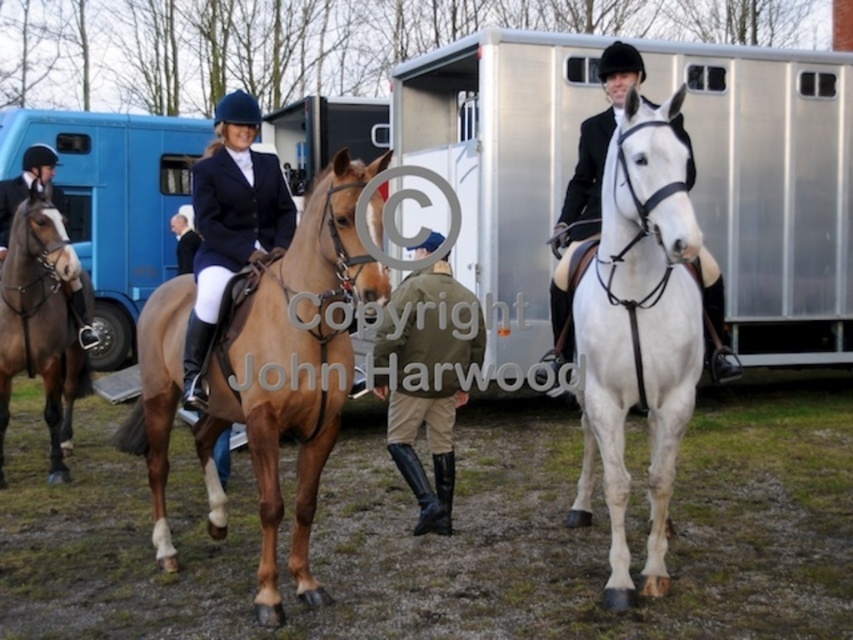
Is point (35, 307) in front of point (408, 275)?

Yes, it is in front of point (408, 275).

Does brown glossy horse at left have a lesser width compared to khaki fabric jacket at center?

Incorrect, brown glossy horse at left's width is not less than khaki fabric jacket at center's.

Looking at this image, measure the distance between point [9,380] and camera.

Point [9,380] is 6.61 meters away from camera.

This screenshot has height=640, width=853. Find the location of `brown glossy horse at left`. brown glossy horse at left is located at coordinates point(41,321).

Is point (669, 344) less distant than point (397, 417)?

Yes, point (669, 344) is closer to viewer.

Is white leather horse at right smaller than khaki fabric jacket at center?

Correct, white leather horse at right occupies less space than khaki fabric jacket at center.

Does point (689, 250) lie behind point (421, 253)?

No.

The image size is (853, 640). Identify the location of white leather horse at right. (637, 332).

Between navy blue fabric jacket at center and brown glossy horse at left, which one is positioned higher?

Positioned higher is navy blue fabric jacket at center.

This screenshot has width=853, height=640. What are the coordinates of `navy blue fabric jacket at center` in the screenshot? It's located at (230, 225).